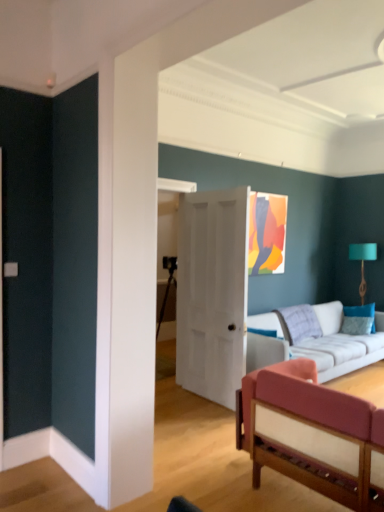
Question: Looking at their shapes, would you say velvet pink couch at lower right, arranged as the 2th studio couch when viewed from the back, is wider or thinner than white fabric couch at center, which ranks as the 2th studio couch in front-to-back order?

Choices:
 (A) thin
 (B) wide

Answer: (B)

Question: Based on their sizes in the image, would you say velvet pink couch at lower right, which is the 1th studio couch in front-to-back order, is bigger or smaller than white fabric couch at center, which ranks as the 2th studio couch in front-to-back order?

Choices:
 (A) big
 (B) small

Answer: (B)

Question: Which of these objects is positioned farthest from the white matte door at center?

Choices:
 (A) white fabric couch at center, which ranks as the 2th studio couch in front-to-back order
 (B) teal fabric lampshade at right
 (C) teal fabric pillow at right
 (D) velvet pink couch at lower right, which is the 1th studio couch in front-to-back order

Answer: (B)

Question: Based on their relative distances, which object is nearer to the white fabric couch at center, which ranks as the 2th studio couch in front-to-back order?

Choices:
 (A) teal fabric lampshade at right
 (B) white matte door at center
 (C) teal fabric pillow at right
 (D) velvet pink couch at lower right, arranged as the 2th studio couch when viewed from the back

Answer: (C)